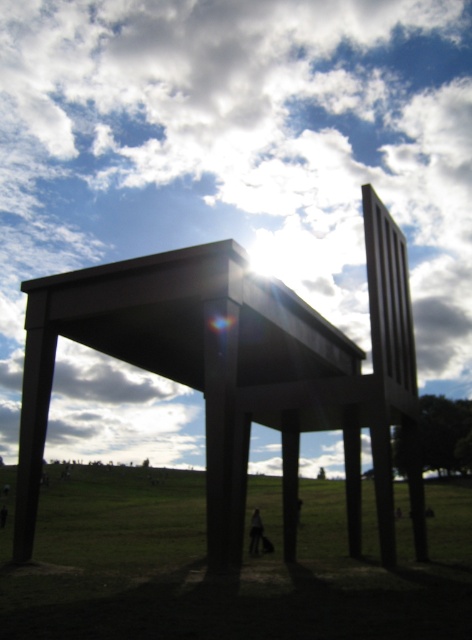
Between white fluffy cloud at upper center and green grass at lower center, which one has more height?

white fluffy cloud at upper center is taller.

Does white fluffy cloud at upper center come in front of green grass at lower center?

No.

Measure the distance between white fluffy cloud at upper center and camera.

The distance of white fluffy cloud at upper center from camera is 14.51 meters.

Find the location of a particular element. Image resolution: width=472 pixels, height=640 pixels. white fluffy cloud at upper center is located at coordinates (239, 150).